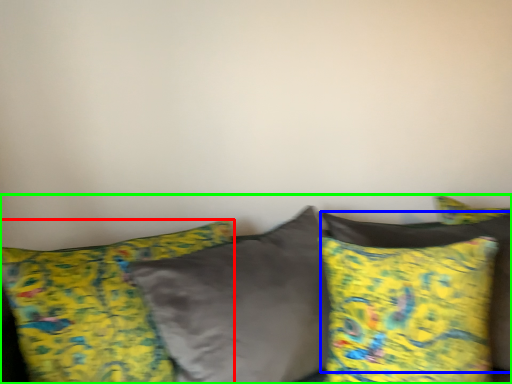
Question: Based on their relative distances, which object is farther from pillow (highlighted by a red box)? Choose from pillow (highlighted by a blue box) and studio couch (highlighted by a green box).

Choices:
 (A) pillow
 (B) studio couch

Answer: (A)